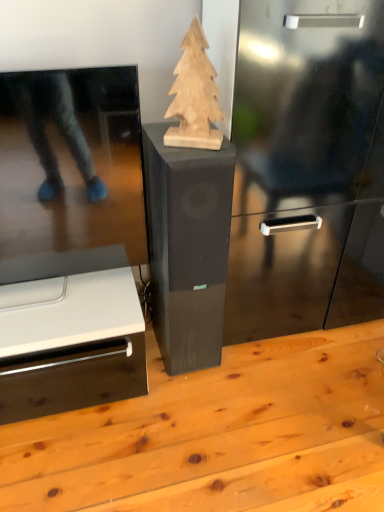
I want to click on black wood speaker at center, so click(x=188, y=247).

The width and height of the screenshot is (384, 512). What do you see at coordinates (195, 96) in the screenshot?
I see `natural wood christmas tree at center` at bounding box center [195, 96].

I want to click on light brown wood table at center, so click(218, 435).

The width and height of the screenshot is (384, 512). In order to click on black wood speaker at center in this screenshot , I will do `click(188, 247)`.

In terms of width, does natural wood christmas tree at center look wider or thinner when compared to light brown wood table at center?

In the image, natural wood christmas tree at center appears to be more narrow than light brown wood table at center.

Who is taller, natural wood christmas tree at center or light brown wood table at center?

With more height is natural wood christmas tree at center.

From a real-world perspective, is natural wood christmas tree at center on light brown wood table at center?

Yes.

Would you say light brown wood table at center is part of natural wood christmas tree at center's contents?

Actually, light brown wood table at center is outside natural wood christmas tree at center.

How many degrees apart are the facing directions of light brown wood table at center and black wood speaker at center?

The facing directions of light brown wood table at center and black wood speaker at center are 178 degrees apart.

From a real-world perspective, which object stands above the other?

From a 3D spatial view, black wood speaker at center is above.

Is light brown wood table at center in contact with black wood speaker at center?

light brown wood table at center and black wood speaker at center are clearly separated.

From the image's perspective, which is above, light brown wood table at center or black wood speaker at center?

black wood speaker at center, from the image's perspective.

Is black wood speaker at center further to the viewer compared to light brown wood table at center?

Yes, it is.

How many degrees apart are the facing directions of black wood speaker at center and light brown wood table at center?

178 degrees separate the facing orientations of black wood speaker at center and light brown wood table at center.

Consider the image. Which is correct: black wood speaker at center is inside light brown wood table at center, or outside of it?

black wood speaker at center is not inside light brown wood table at center, it's outside.

Is point (181, 248) closer to viewer compared to point (45, 457)?

Yes, point (181, 248) is in front of point (45, 457).

Does natural wood christmas tree at center turn towards black wood speaker at center?

No, natural wood christmas tree at center is not turned towards black wood speaker at center.

Between point (203, 130) and point (211, 213), which one is positioned in front?

Positioned in front is point (203, 130).

In terms of height, does natural wood christmas tree at center look taller or shorter compared to black wood speaker at center?

In the image, natural wood christmas tree at center appears to be shorter than black wood speaker at center.

Identify the location of furniture that is on the left side of natural wood christmas tree at center. The height and width of the screenshot is (512, 384). (188, 247).

Is black wood speaker at center positioned with its back to natural wood christmas tree at center?

black wood speaker at center is not turned away from natural wood christmas tree at center.

Does black wood speaker at center have a greater width compared to natural wood christmas tree at center?

Yes.

Who is taller, black wood speaker at center or natural wood christmas tree at center?

black wood speaker at center is taller.

From a real-world perspective, is black wood speaker at center located higher than natural wood christmas tree at center?

No, from a real-world perspective, black wood speaker at center is not above natural wood christmas tree at center.

Is the surface of light brown wood table at center in direct contact with natural wood christmas tree at center?

No.

Is light brown wood table at center at the right side of natural wood christmas tree at center?

Indeed, light brown wood table at center is positioned on the right side of natural wood christmas tree at center.

Which of these two, light brown wood table at center or natural wood christmas tree at center, stands taller?

Standing taller between the two is natural wood christmas tree at center.

Where is `table below the natural wood christmas tree at center (from the image's perspective)`? The image size is (384, 512). table below the natural wood christmas tree at center (from the image's perspective) is located at coordinates (218, 435).

This screenshot has width=384, height=512. I want to click on table in front of the natural wood christmas tree at center, so click(218, 435).

The height and width of the screenshot is (512, 384). Identify the location of table on the right of black wood speaker at center. (218, 435).

Based on their spatial positions, is natural wood christmas tree at center or black wood speaker at center further from light brown wood table at center?

natural wood christmas tree at center lies further to light brown wood table at center than the other object.

Which object lies nearer to the anchor point natural wood christmas tree at center, light brown wood table at center or black wood speaker at center?

Based on the image, black wood speaker at center appears to be nearer to natural wood christmas tree at center.

Based on their spatial positions, is natural wood christmas tree at center or light brown wood table at center further from black wood speaker at center?

light brown wood table at center.

Looking at the image, which one is located closer to light brown wood table at center, black wood speaker at center or natural wood christmas tree at center?

black wood speaker at center is positioned closer to the anchor light brown wood table at center.

Estimate the real-world distances between objects in this image. Which object is further from black wood speaker at center, light brown wood table at center or natural wood christmas tree at center?

Among the two, light brown wood table at center is located further to black wood speaker at center.

Looking at the image, which one is located closer to natural wood christmas tree at center, black wood speaker at center or light brown wood table at center?

Among the two, black wood speaker at center is located nearer to natural wood christmas tree at center.

Find the location of `furniture between natural wood christmas tree at center and light brown wood table at center vertically`. furniture between natural wood christmas tree at center and light brown wood table at center vertically is located at coordinates (188, 247).